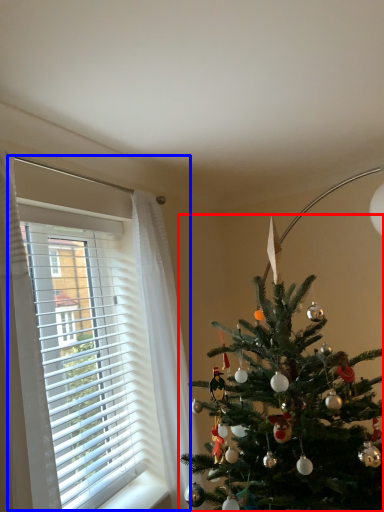
Question: Among these objects, which one is farthest to the camera, christmas tree (highlighted by a red box) or window (highlighted by a blue box)?

Choices:
 (A) christmas tree
 (B) window

Answer: (A)